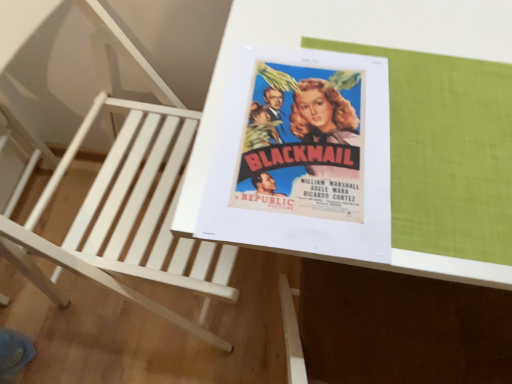
What are the coordinates of `empty space that is ontop of matte paper poster at center (from a real-world perspective)` in the screenshot? It's located at (298, 135).